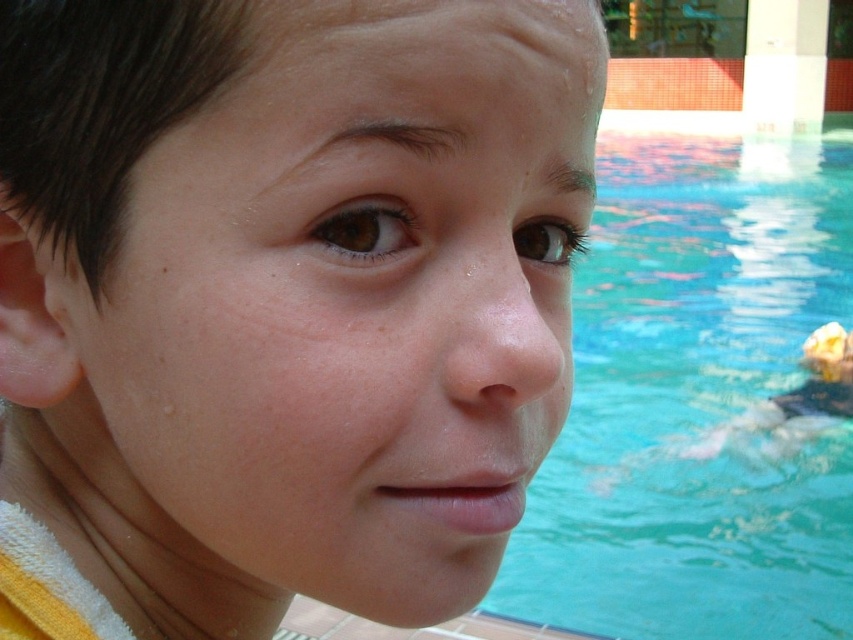
Is dry skin at center closer to the viewer compared to blue water at center?

Yes, dry skin at center is in front of blue water at center.

Is dry skin at center below blue water at center?

Yes, dry skin at center is below blue water at center.

Identify the location of dry skin at center. (344, 314).

This screenshot has height=640, width=853. Identify the location of dry skin at center. (344, 314).